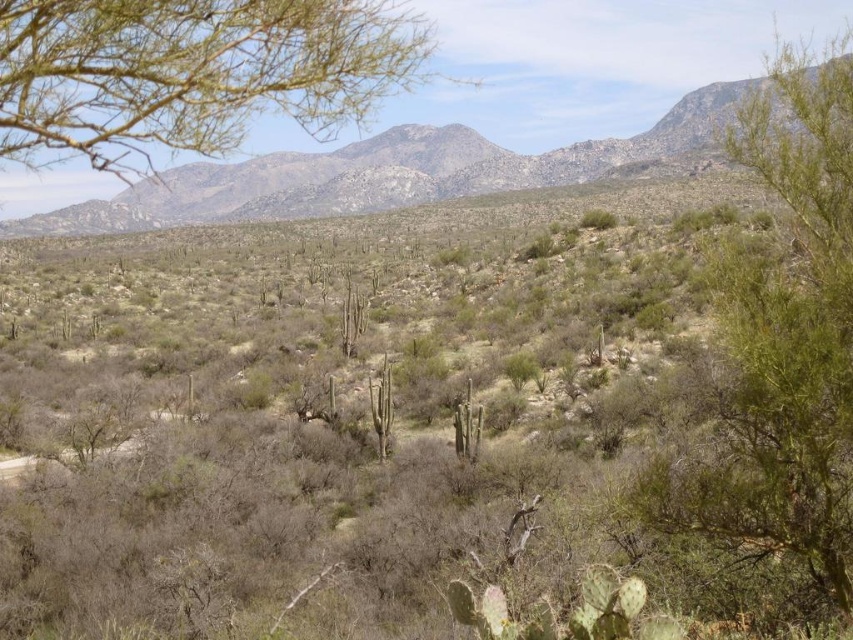
Can you confirm if green leafy bush at right is thinner than gray rocky mountain at upper center?

Indeed, green leafy bush at right has a lesser width compared to gray rocky mountain at upper center.

Does green leafy bush at right appear on the left side of gray rocky mountain at upper center?

Incorrect, green leafy bush at right is not on the left side of gray rocky mountain at upper center.

Is point (798, 556) behind point (233, 182)?

No, it is in front of (233, 182).

Locate an element on the screen. This screenshot has width=853, height=640. green leafy bush at right is located at coordinates (778, 346).

Does green leafy bush at right appear on the right side of green leafy tree at upper left?

Yes, green leafy bush at right is to the right of green leafy tree at upper left.

Where is `green leafy bush at right`? green leafy bush at right is located at coordinates (778, 346).

Does green leafy tree at upper left appear over gray rocky mountain at upper center?

Yes.

The width and height of the screenshot is (853, 640). What do you see at coordinates (193, 74) in the screenshot? I see `green leafy tree at upper left` at bounding box center [193, 74].

Locate an element on the screen. The width and height of the screenshot is (853, 640). green leafy tree at upper left is located at coordinates (193, 74).